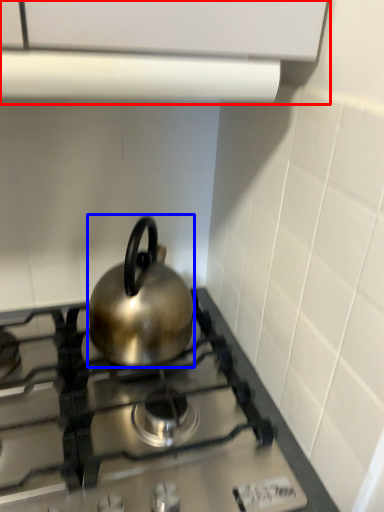
Question: Which point is further to the camera, vent (highlighted by a red box) or kettle (highlighted by a blue box)?

Choices:
 (A) vent
 (B) kettle

Answer: (B)